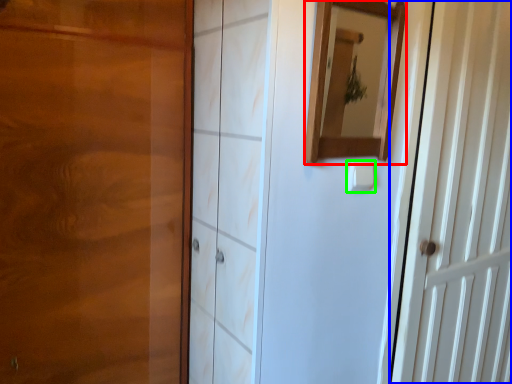
Question: Considering the real-world distances, which object is closest to mirror (highlighted by a red box)? door (highlighted by a blue box) or light switch (highlighted by a green box).

Choices:
 (A) door
 (B) light switch

Answer: (B)